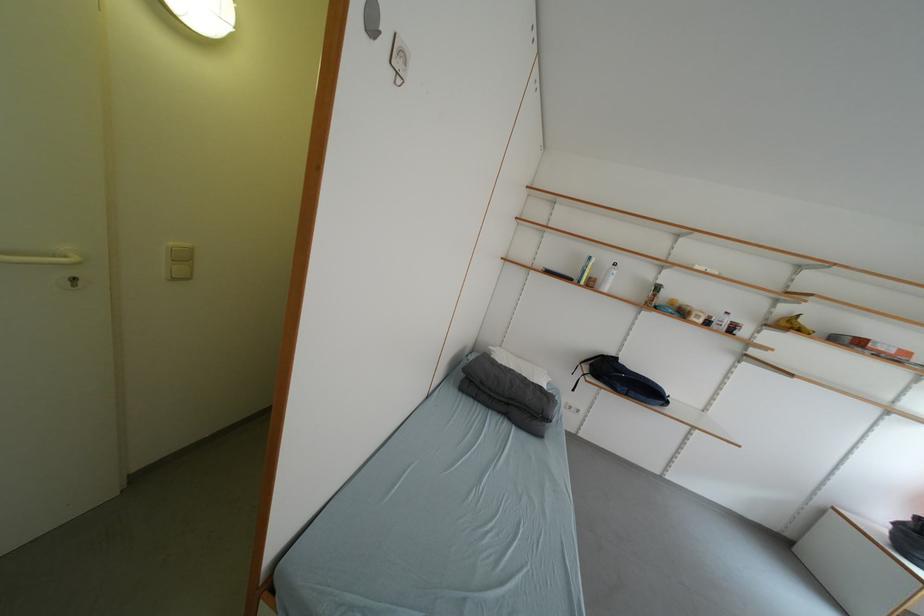
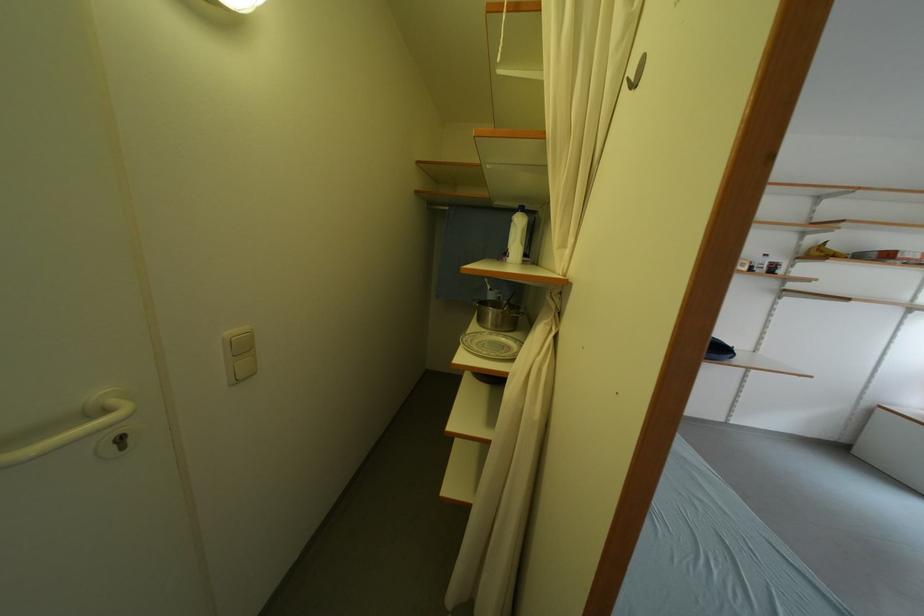
Where in the second image is the point corresponding to (180,246) from the first image?

(237, 336)